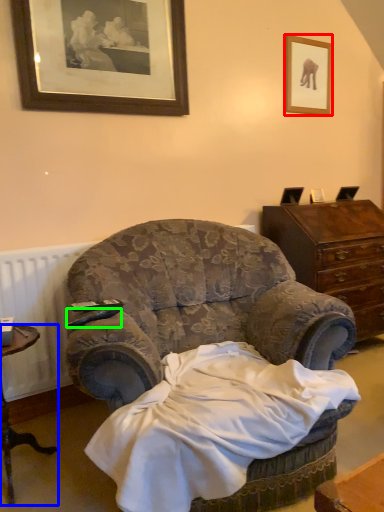
Question: Which object is the farthest from picture frame (highlighted by a red box)? Choose among these: desk (highlighted by a blue box) or remote control (highlighted by a green box).

Choices:
 (A) desk
 (B) remote control

Answer: (A)